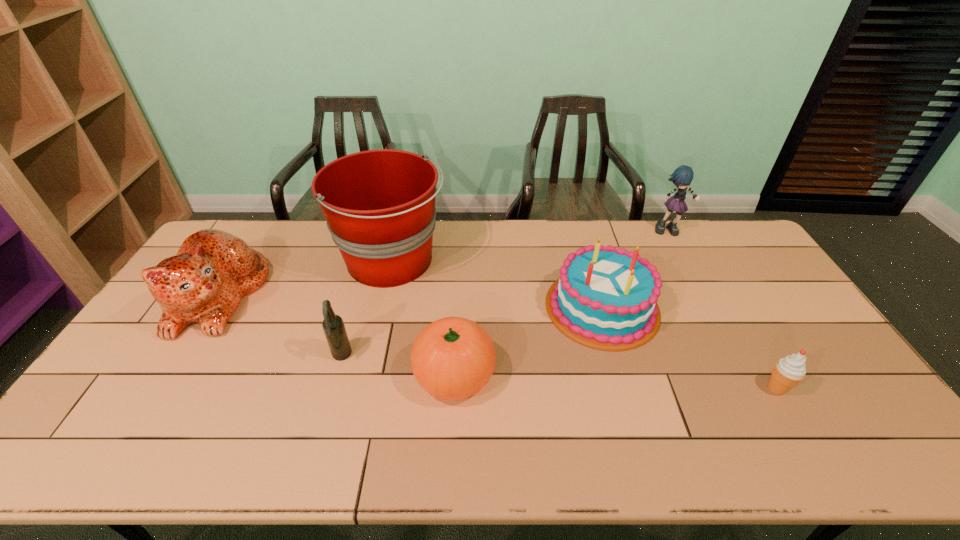
Locate an element on the screen. The image size is (960, 540). vacant space situated 0.080m on the left of the birthday cake is located at coordinates (516, 307).

The image size is (960, 540). Find the location of `vacant region located 0.090m on the left of the beer bottle`. vacant region located 0.090m on the left of the beer bottle is located at coordinates [x=300, y=356].

You are a GUI agent. You are given a task and a screenshot of the screen. Output one action in this format:
    pyautogui.click(x=<x>, y=<y>)
    Task: Click on the free spot located 0.110m on the left of the pumpkin
    The width and height of the screenshot is (960, 540).
    Given the screenshot: What is the action you would take?
    pyautogui.click(x=372, y=374)

Locate an element on the screen. The width and height of the screenshot is (960, 540). free region located 0.400m on the left of the shortest object is located at coordinates (610, 388).

Identify the location of bucket at the far edge. The image size is (960, 540). (379, 205).

You are a GUI agent. You are given a task and a screenshot of the screen. Output one action in this format:
    pyautogui.click(x=<x>, y=<y>)
    Task: Click on the rag doll at the far edge
    This screenshot has width=960, height=540.
    Given the screenshot: What is the action you would take?
    pyautogui.click(x=682, y=177)

Locate an element on the screen. The width and height of the screenshot is (960, 540). cat located in the far edge section of the desktop is located at coordinates (203, 283).

Locate an element on the screen. The height and width of the screenshot is (540, 960). object that is at the left edge is located at coordinates (203, 283).

Find the location of a particular element. This screenshot has height=540, width=960. object at the far left corner is located at coordinates (203, 283).

In the image, there is a desktop. Identify the location of vacant space at the far edge. The height and width of the screenshot is (540, 960). (547, 226).